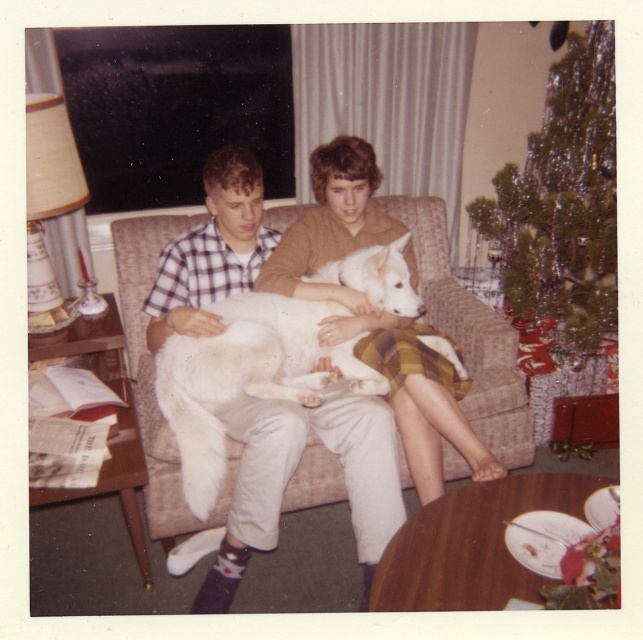
You are a guest entering the living room and see the beige fabric couch at center and the white soft fur dog at center. Which object is taller?

The beige fabric couch at center is taller than the white soft fur dog at center.

You are trying to decide which dog to adopt between the white fluffy dog at center and the white soft fur dog at center. Based on their height, which one is shorter?

The white fluffy dog at center is shorter than the white soft fur dog at center.